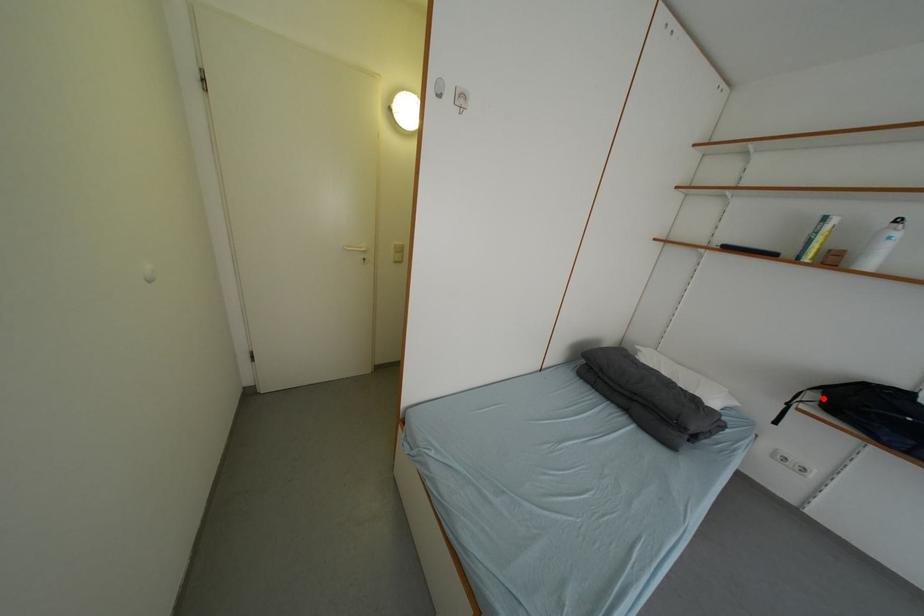
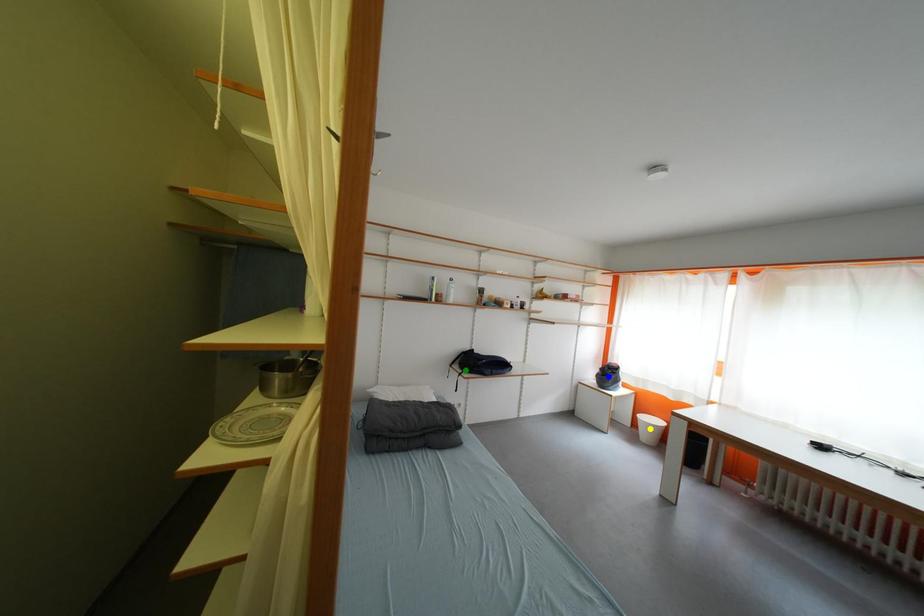
Question: I am providing you with two images of the same scene from different viewpoints. A red point is marked on the first image. You are given multiple points on the second image. Can you choose the point in image 2 that corresponds to the point in image 1?

Choices:
 (A) green point
 (B) yellow point
 (C) blue point

Answer: (A)